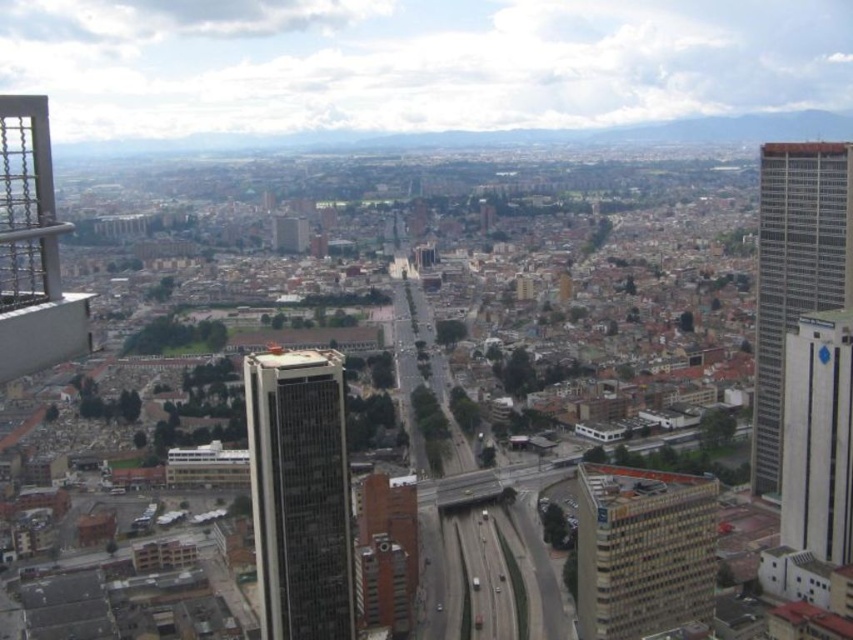
You are a drone operator who needs to fly a drone from the highway in the foreground to the glassy gray skyscraper at center. Based on the coordinates provided, in which general direction should you fly the drone to reach the skyscraper?

The glassy gray skyscraper at center is located at coordinates point (x=299, y=493), so you should fly the drone towards the center of the image to reach it.

You are a drone operator tasked with flying a drone between the beige textured building at center and the white glossy building at right. The drone has a maximum flight distance of 30 meters. Can the drone safely complete the flight between these two buildings without exceeding its range?

The distance between the beige textured building at center and the white glossy building at right is 33.10 meters. Since the drone has a maximum flight distance of 30 meters, it cannot safely complete the flight between these two buildings without exceeding its range.

You are a drone operator who needs to deliver a package to the beige textured building at center and the white glossy building at right. Based on the aerial view, which building should you target first to ensure the shortest flight path?

The beige textured building at center should be targeted first because it is closer to the viewer than the white glossy building at right, resulting in a shorter flight distance.